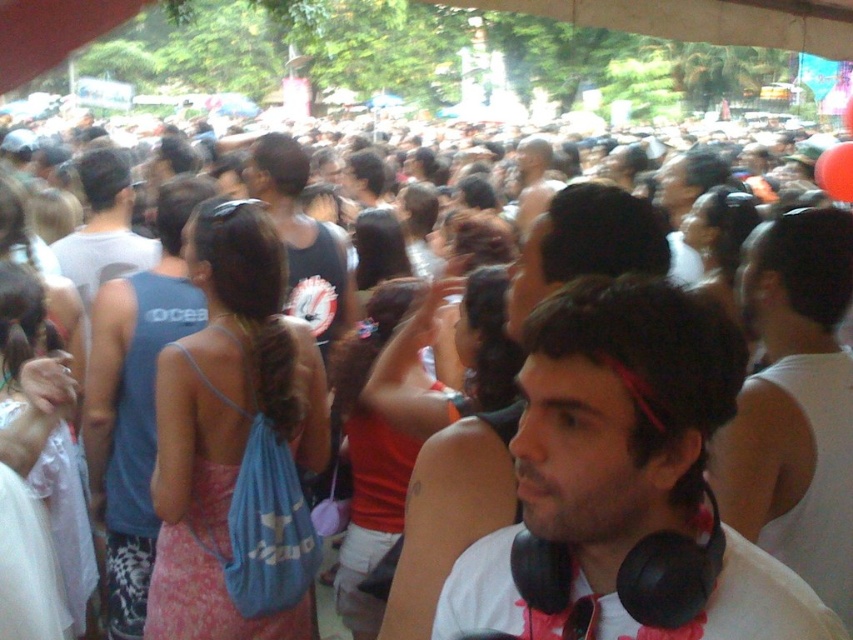
Question: Among these points, which one is nearest to the camera?

Choices:
 (A) (434, 596)
 (B) (128, 580)

Answer: (A)

Question: Estimate the real-world distances between objects in this image. Which object is farther from the white matte tank top at center?

Choices:
 (A) white matte headphones at center
 (B) blue fabric tank top at left
 (C) black matte headphones at center

Answer: (B)

Question: Is black matte headphones at center to the left of white matte tank top at center from the viewer's perspective?

Choices:
 (A) no
 (B) yes

Answer: (B)

Question: Which of the following is the farthest from the observer?

Choices:
 (A) white matte headphones at center
 (B) blue fabric tank top at left
 (C) white matte tank top at center

Answer: (B)

Question: Considering the relative positions of black matte headphones at center and white matte tank top at center in the image provided, where is black matte headphones at center located with respect to white matte tank top at center?

Choices:
 (A) below
 (B) above

Answer: (A)

Question: Is black matte headphones at center wider than white matte headphones at center?

Choices:
 (A) no
 (B) yes

Answer: (B)